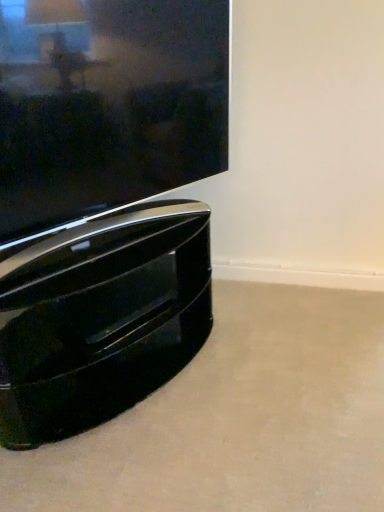
This screenshot has height=512, width=384. Identify the location of vacant space underneath glossy black tv at lower left (from a real-world perspective). (120, 234).